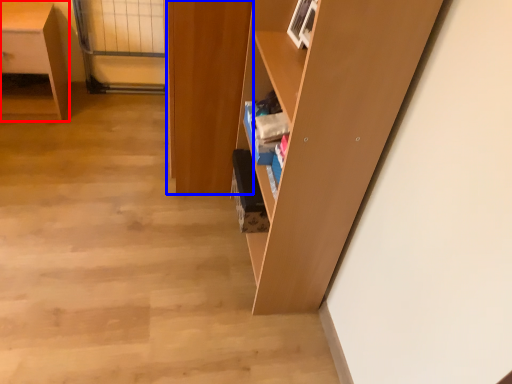
Question: Among these objects, which one is nearest to the camera, desk (highlighted by a red box) or cabinetry (highlighted by a blue box)?

Choices:
 (A) desk
 (B) cabinetry

Answer: (B)